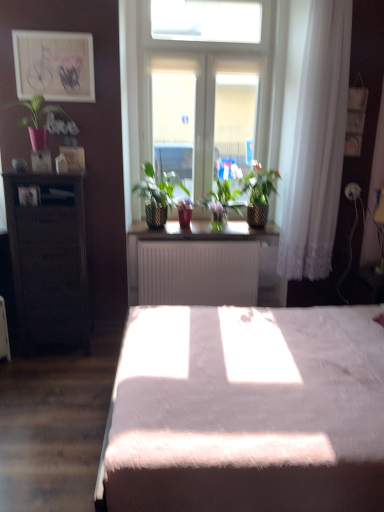
Question: Is green matte plant at center, which is the second houseplant in right-to-left order, positioned with its back to white glass window at center?

Choices:
 (A) yes
 (B) no

Answer: (A)

Question: Can you confirm if green matte plant at center, which is the second houseplant in right-to-left order, is smaller than white glass window at center?

Choices:
 (A) yes
 (B) no

Answer: (A)

Question: Can you see green matte plant at center, which is counted as the 3th houseplant, starting from the left, touching white glass window at center?

Choices:
 (A) yes
 (B) no

Answer: (B)

Question: Can you confirm if green matte plant at center, which is the second houseplant in right-to-left order, is shorter than white glass window at center?

Choices:
 (A) yes
 (B) no

Answer: (A)

Question: Is green matte plant at center, which is counted as the 3th houseplant, starting from the left, thinner than white glass window at center?

Choices:
 (A) yes
 (B) no

Answer: (B)

Question: Is green woven basket at center, which is the third houseplant in right-to-left order, inside the boundaries of white matte radiator at center, the second table positioned from the left, or outside?

Choices:
 (A) outside
 (B) inside

Answer: (A)

Question: From their relative heights in the image, would you say green woven basket at center, which is the third houseplant in right-to-left order, is taller or shorter than white matte radiator at center, which ranks as the 1th table in back-to-front order?

Choices:
 (A) tall
 (B) short

Answer: (B)

Question: In the image, is green woven basket at center, which is the third houseplant in right-to-left order, positioned in front of or behind white matte radiator at center, the 1th table positioned from the right?

Choices:
 (A) front
 (B) behind

Answer: (A)

Question: From the image's perspective, is green woven basket at center, which ranks as the second houseplant in left-to-right order, above or below white matte radiator at center, the second table positioned from the left?

Choices:
 (A) below
 (B) above

Answer: (B)

Question: Considering the relative positions of white lace curtain at right and matte pink pot at upper left, positioned as the fourth houseplant in right-to-left order, in the image provided, is white lace curtain at right to the left or to the right of matte pink pot at upper left, positioned as the fourth houseplant in right-to-left order,?

Choices:
 (A) right
 (B) left

Answer: (A)

Question: Is white lace curtain at right in front of or behind matte pink pot at upper left, the first houseplant positioned from the left, in the image?

Choices:
 (A) behind
 (B) front

Answer: (B)

Question: Do you think white lace curtain at right is within matte pink pot at upper left, the first houseplant positioned from the left, or outside of it?

Choices:
 (A) inside
 (B) outside

Answer: (B)

Question: Considering the positions of white lace curtain at right and matte pink pot at upper left, positioned as the fourth houseplant in right-to-left order, in the image, is white lace curtain at right taller or shorter than matte pink pot at upper left, positioned as the fourth houseplant in right-to-left order,?

Choices:
 (A) tall
 (B) short

Answer: (A)

Question: Considering the positions of matte wooden picture frame at upper left and matte pink pot at upper left, positioned as the fourth houseplant in right-to-left order, in the image, is matte wooden picture frame at upper left wider or thinner than matte pink pot at upper left, positioned as the fourth houseplant in right-to-left order,?

Choices:
 (A) wide
 (B) thin

Answer: (B)

Question: Is matte wooden picture frame at upper left inside or outside of matte pink pot at upper left, the first houseplant positioned from the left?

Choices:
 (A) inside
 (B) outside

Answer: (B)